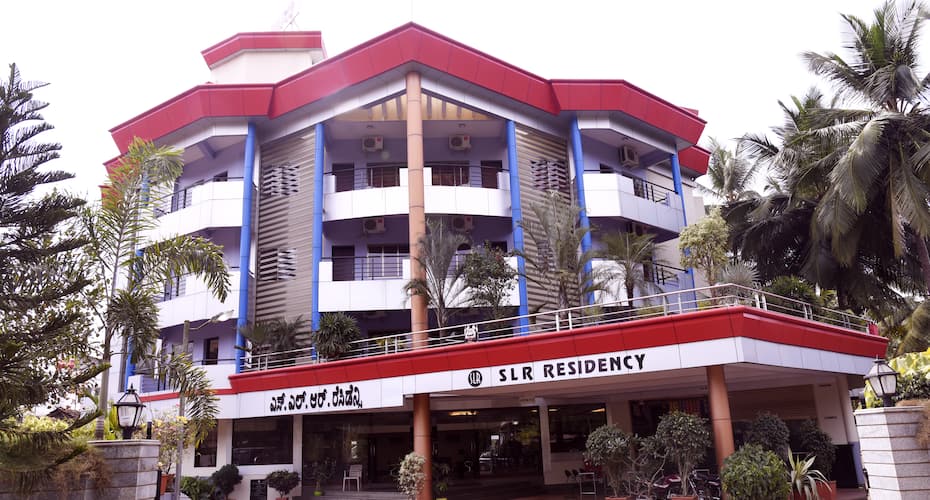
The width and height of the screenshot is (930, 500). What are the coordinates of `lamps` in the screenshot? It's located at (883, 380), (130, 408).